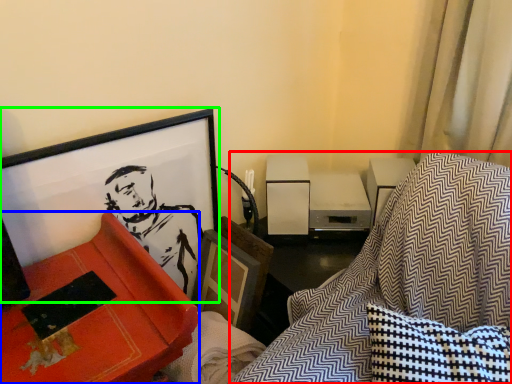
Question: Which object is positioned farthest from swivel chair (highlighted by a red box)? Select from furniture (highlighted by a blue box) and picture frame (highlighted by a green box).

Choices:
 (A) furniture
 (B) picture frame

Answer: (B)